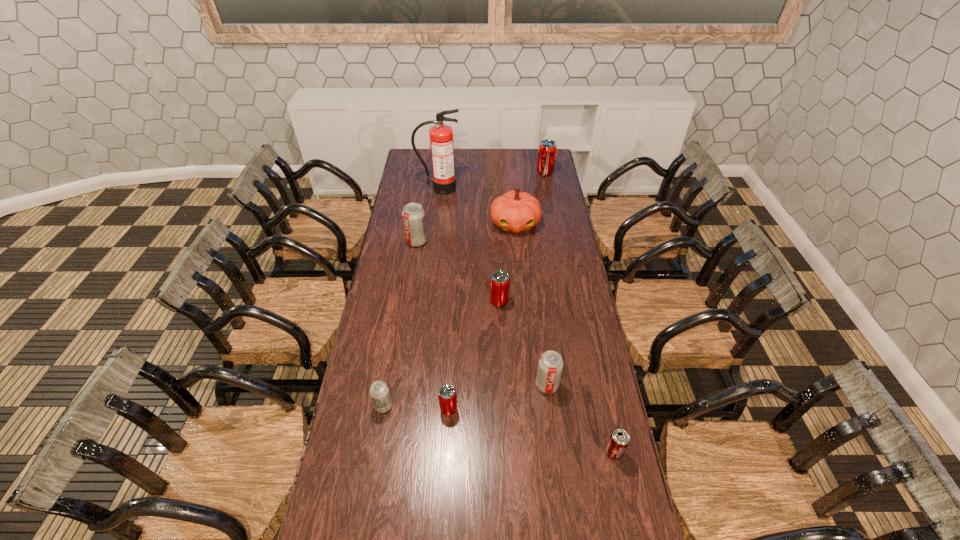
This screenshot has width=960, height=540. I want to click on the second smallest red soda can, so click(499, 282).

Locate an element on the screen. The image size is (960, 540). the nearest red soda can is located at coordinates pyautogui.click(x=447, y=395).

This screenshot has height=540, width=960. I want to click on the smallest red soda can, so click(447, 395).

What are the coordinates of `the smallest gray soda can` in the screenshot? It's located at (x=379, y=391).

The width and height of the screenshot is (960, 540). In order to click on the nearest object in this screenshot , I will do `click(619, 440)`.

Locate an element on the screen. vacant space located 0.340m on the front-facing side of the tallest object is located at coordinates (434, 235).

This screenshot has width=960, height=540. I want to click on vacant region located on the front-facing side of the pumpkin, so click(x=521, y=295).

Image resolution: width=960 pixels, height=540 pixels. Identify the location of vacant space located on the left of the rightmost soda can. click(x=512, y=173).

Locate an element on the screen. The height and width of the screenshot is (540, 960). vacant space located on the front of the biggest gray soda can is located at coordinates (414, 260).

At what (x,y) coordinates should I click in order to perform the action: click on vacant space positioned 0.270m on the front of the second farthest gray soda can. Please return your answer as a coordinate pair (x, y). The height and width of the screenshot is (540, 960). Looking at the image, I should click on (558, 474).